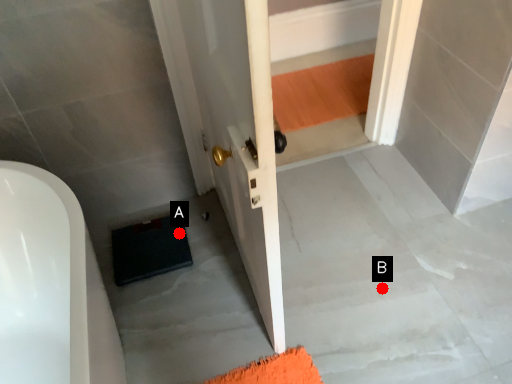
Question: Two points are circled on the image, labeled by A and B beside each circle. Which point is closer to the camera?

Choices:
 (A) A is closer
 (B) B is closer

Answer: (B)